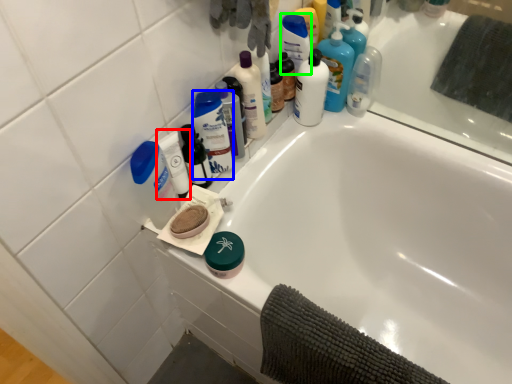
Question: Considering the real-world distances, which object is farthest from mouthwash (highlighted by a red box)? cleaning product (highlighted by a blue box) or cleaning product (highlighted by a green box)?

Choices:
 (A) cleaning product
 (B) cleaning product

Answer: (B)